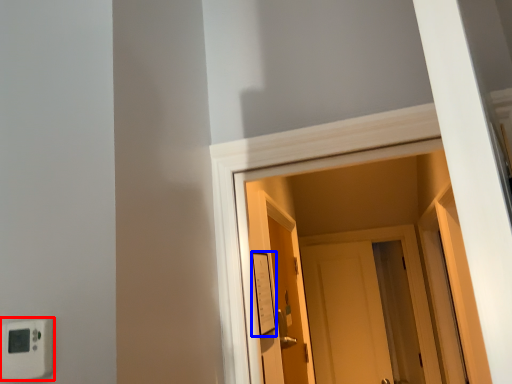
Question: Which object is closer to the camera taking this photo, light switch (highlighted by a red box) or light switch (highlighted by a blue box)?

Choices:
 (A) light switch
 (B) light switch

Answer: (A)